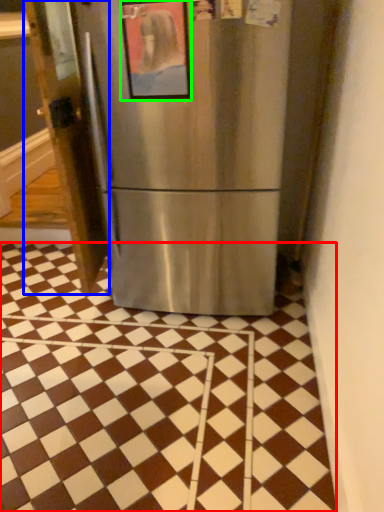
Question: Considering the real-world distances, which object is farthest from tile (highlighted by a red box)? door (highlighted by a blue box) or picture frame (highlighted by a green box)?

Choices:
 (A) door
 (B) picture frame

Answer: (B)